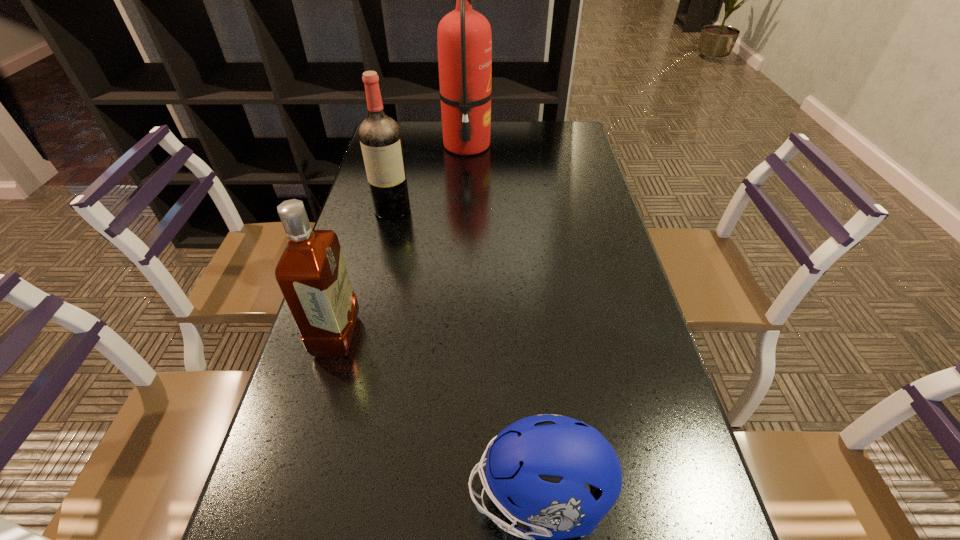
You are a GUI agent. You are given a task and a screenshot of the screen. Output one action in this format:
    pyautogui.click(x=<x>, y=<y>)
    Task: Click on the free space that satisfies the following two spatial constraints: 1. on the front-facing side of the third nearest object; 2. on the front label of the nearer liquor
    The height and width of the screenshot is (540, 960).
    Given the screenshot: What is the action you would take?
    pyautogui.click(x=363, y=336)

At what (x,y) coordinates should I click in order to perform the action: click on vacant region that satisfies the following two spatial constraints: 1. on the side of the farthest object with the nozzle and handle; 2. on the front-facing side of the second farthest object. Please return your answer as a coordinate pair (x, y). Looking at the image, I should click on (464, 210).